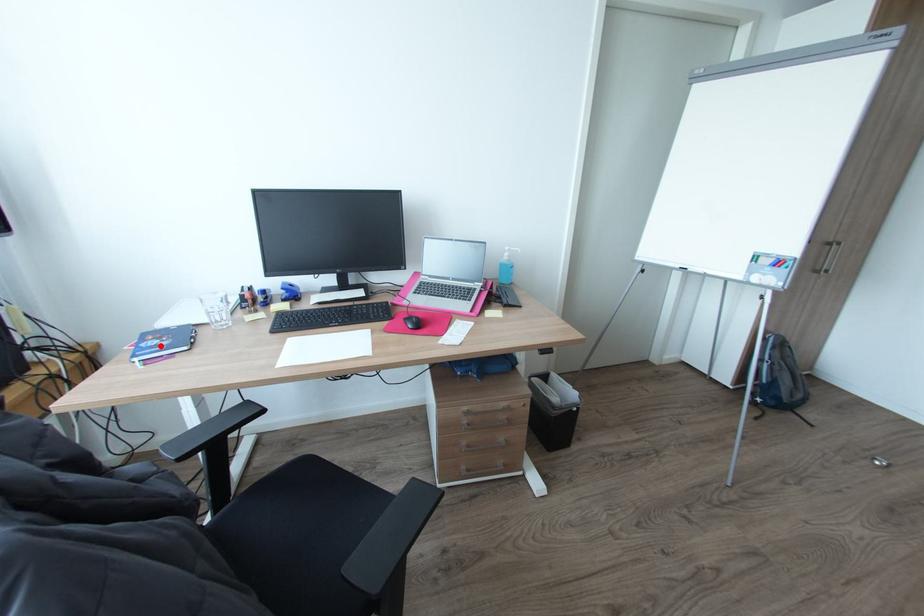
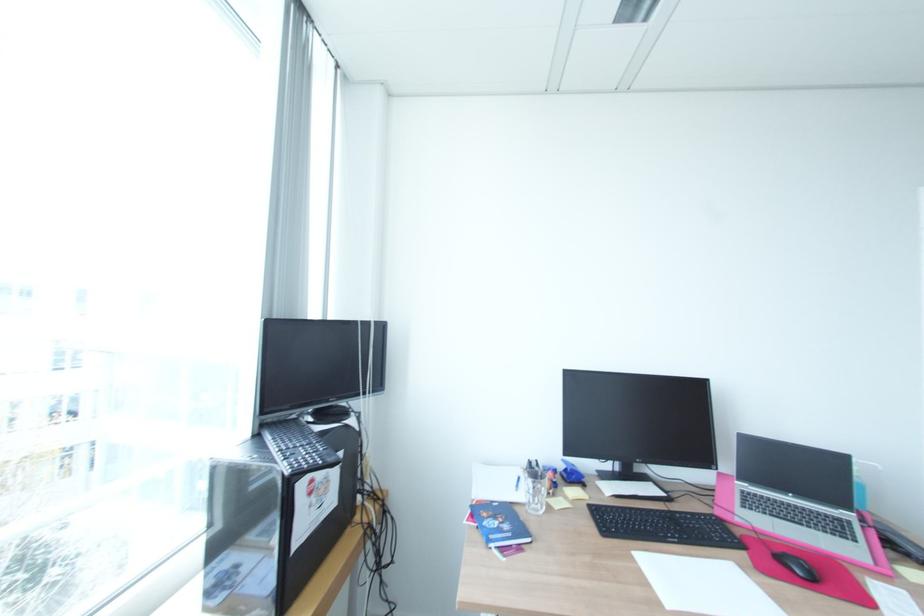
In the second image, find the point that corresponds to the highlighted location in the first image.

(504, 530)